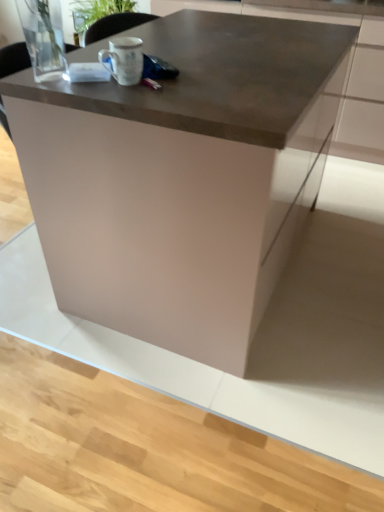
You are a GUI agent. You are given a task and a screenshot of the screen. Output one action in this format:
    pyautogui.click(x=<x>, y=<y>)
    Task: Click on the vacant space in front of white matte mug at upper center
    
    Given the screenshot: What is the action you would take?
    pyautogui.click(x=120, y=95)